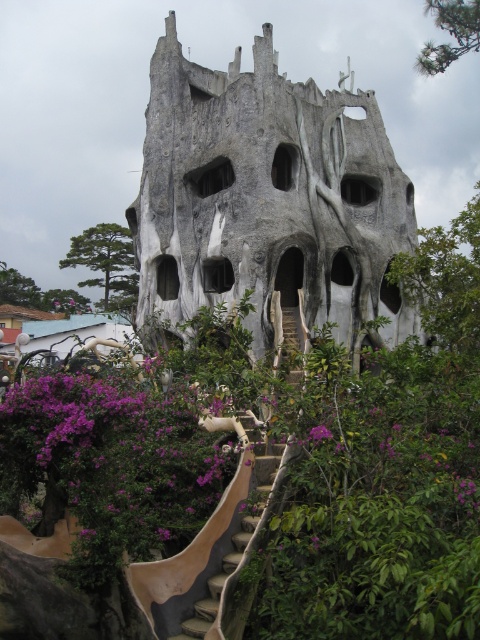
Question: Does purple matte flower at lower left lie behind purple leafy tree at upper left?

Choices:
 (A) yes
 (B) no

Answer: (B)

Question: Which of the following is the closest to the observer?

Choices:
 (A) (17, 282)
 (B) (147, 224)
 (C) (459, 49)

Answer: (B)

Question: Does purple matte flower at lower left appear on the right side of green leafy tree at upper left?

Choices:
 (A) no
 (B) yes

Answer: (B)

Question: Does gray textured rock formation at center lie behind purple matte flower at center?

Choices:
 (A) yes
 (B) no

Answer: (A)

Question: Estimate the real-world distances between objects in this image. Which object is closer to the green leafy tree at upper left?

Choices:
 (A) green leafy tree at center
 (B) green leafy tree at upper right

Answer: (A)

Question: Considering the real-world distances, which object is closest to the purple matte flower at lower left?

Choices:
 (A) purple matte flower at center
 (B) purple leafy tree at upper left
 (C) green leafy tree at center
 (D) green leafy tree at upper left

Answer: (A)